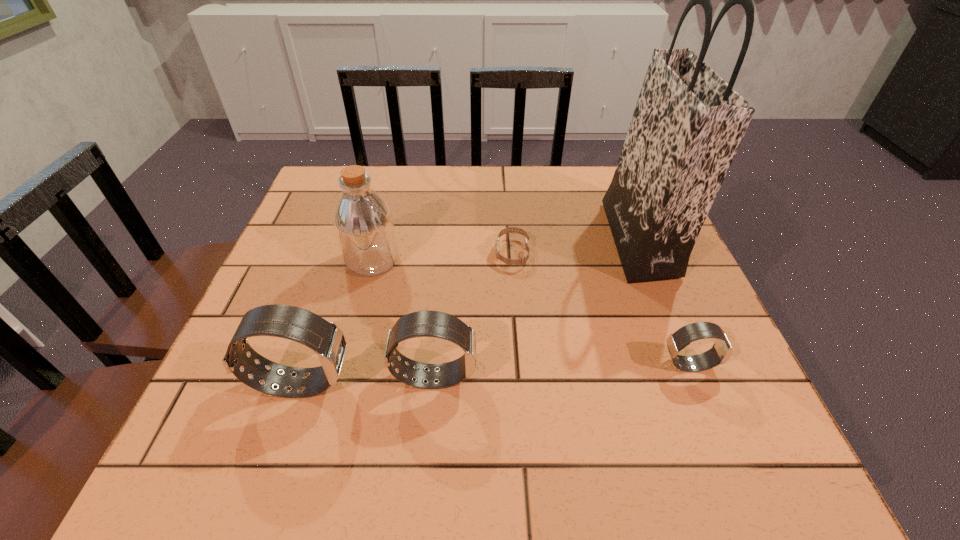
The height and width of the screenshot is (540, 960). What are the coordinates of `bottle at the left edge` in the screenshot? It's located at (363, 222).

This screenshot has height=540, width=960. What are the coordinates of `watch located in the right edge section of the desktop` in the screenshot? It's located at (721, 351).

The width and height of the screenshot is (960, 540). Find the location of `shopping bag that is at the right edge`. shopping bag that is at the right edge is located at coordinates (688, 123).

Where is `object that is at the near left corner`? object that is at the near left corner is located at coordinates (325, 338).

What are the coordinates of `object that is positioned at the far right corner` in the screenshot? It's located at (688, 123).

This screenshot has height=540, width=960. What are the coordinates of `object situated at the near right corner` in the screenshot? It's located at (721, 351).

Where is `free spot at the far edge of the desktop`? The image size is (960, 540). free spot at the far edge of the desktop is located at coordinates (425, 210).

You are a GUI agent. You are given a task and a screenshot of the screen. Output one action in this format:
    pyautogui.click(x=<x>, y=<y>)
    Task: Click on the vacant space at the near edge of the desktop
    
    Given the screenshot: What is the action you would take?
    pyautogui.click(x=457, y=388)

Image resolution: width=960 pixels, height=540 pixels. In order to click on free spot at the far left corner of the desktop in this screenshot , I will do `click(330, 174)`.

This screenshot has width=960, height=540. In order to click on vacant area at the far right corner of the desktop in this screenshot , I will do `click(609, 174)`.